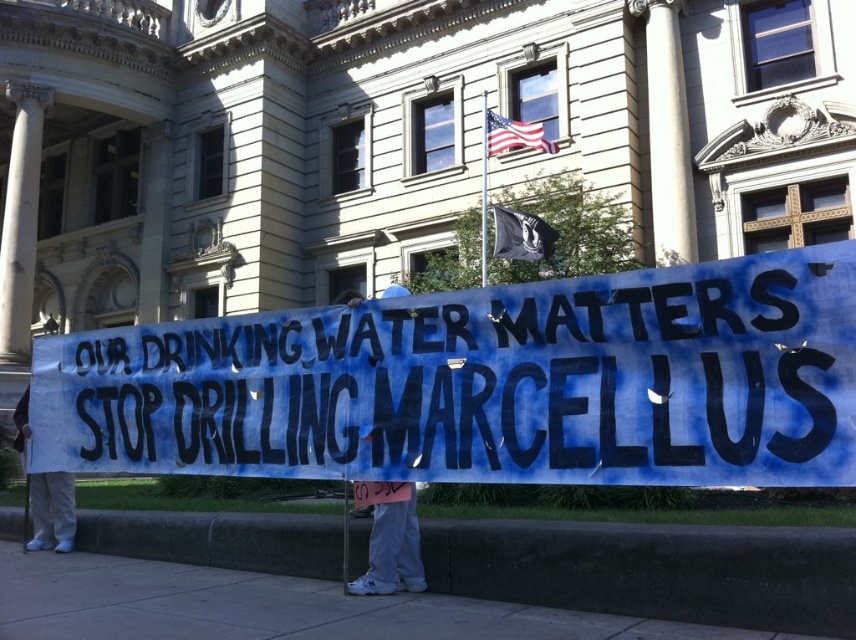
You are a photographer standing in front of the government building. You want to take a photo of the banner held by the protesters. To ensure the banner is centered in your shot, should you position yourself closer to or farther from the white marble column at left?

The white marble column at left is located at point [21,221], which means it is positioned to the left side of the image. To center the banner in your photo, you should move closer to the white marble column at left so that the banner occupies the central area of the frame.

You are a photographer taking a picture of the protest scene. You notice the white fabric banner at lower center and the white fabric sign at lower left. Which object should you focus on first if you want to capture both in the frame without moving the camera?

The white fabric banner at lower center is above the white fabric sign at lower left, so focusing on the banner first will ensure both are in the frame as the sign is below it.